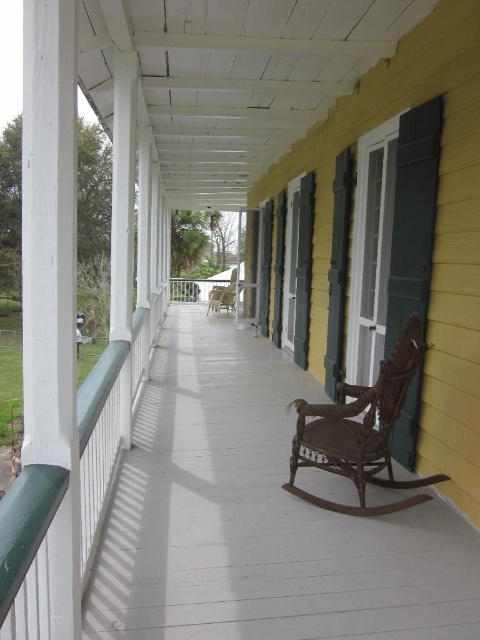
Does white painted wood porch at center have a larger size compared to wooden rocking chair at center?

Actually, white painted wood porch at center might be smaller than wooden rocking chair at center.

Between white painted wood porch at center and wooden rocking chair at center, which one is positioned lower?

white painted wood porch at center is lower down.

Between point (191, 611) and point (216, 307), which one is positioned behind?

Point (216, 307)

You are a GUI agent. You are given a task and a screenshot of the screen. Output one action in this format:
    pyautogui.click(x=<x>, y=<y>)
    Task: Click on the white painted wood porch at center
    The width and height of the screenshot is (480, 640).
    Given the screenshot: What is the action you would take?
    pyautogui.click(x=257, y=518)

Is point (211, 522) less distant than point (319, 436)?

Yes.

Who is positioned more to the left, white painted wood porch at center or brown wicker rocking chair at center-right?

Positioned to the left is white painted wood porch at center.

Is point (331, 529) positioned after point (380, 435)?

No.

Locate an element on the screen. The width and height of the screenshot is (480, 640). white painted wood porch at center is located at coordinates (257, 518).

Can you confirm if brown wicker rocking chair at center-right is positioned below wooden rocking chair at center?

Indeed, brown wicker rocking chair at center-right is positioned under wooden rocking chair at center.

Is brown wicker rocking chair at center-right bigger than wooden rocking chair at center?

Yes, brown wicker rocking chair at center-right is bigger than wooden rocking chair at center.

Where is `brown wicker rocking chair at center-right`? This screenshot has height=640, width=480. brown wicker rocking chair at center-right is located at coordinates (360, 432).